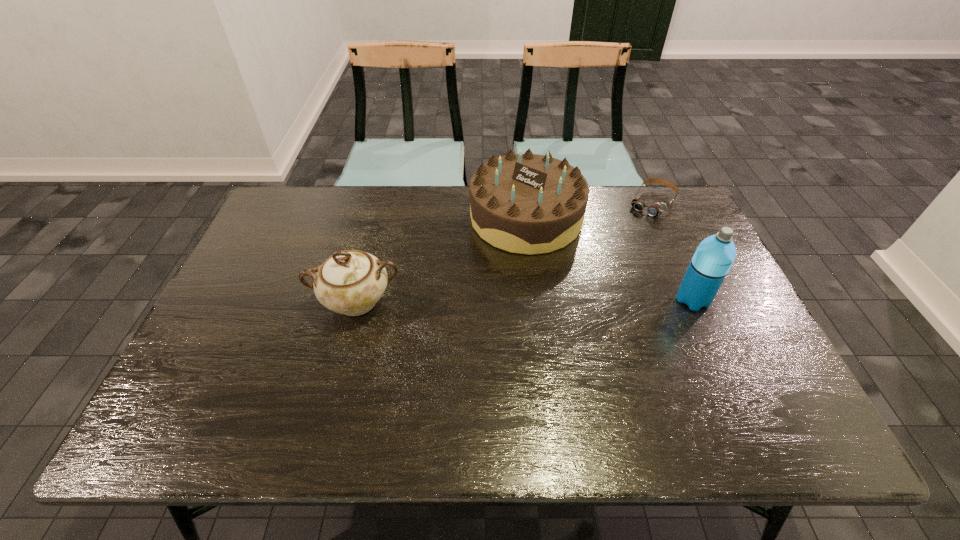
Image resolution: width=960 pixels, height=540 pixels. Find the location of `chinaware`. chinaware is located at coordinates (350, 282).

Where is `the tallest object`? the tallest object is located at coordinates (711, 262).

What are the coordinates of `the second object from left to right` in the screenshot? It's located at (527, 203).

At what (x,y) coordinates should I click in order to perform the action: click on the shortest object. Please return your answer as a coordinate pair (x, y). The image size is (960, 540). Looking at the image, I should click on (656, 209).

Image resolution: width=960 pixels, height=540 pixels. Identify the location of free spot located on the back of the leftmost object. (381, 205).

Locate an element on the screen. free space located 0.240m on the left of the tallest object is located at coordinates (586, 300).

Identify the location of blank area located 0.310m on the front-facing side of the birthday cake. (474, 334).

Find the location of `vacant area situated 0.130m on the front-facing side of the birthday cake`. vacant area situated 0.130m on the front-facing side of the birthday cake is located at coordinates (496, 284).

The image size is (960, 540). Identify the location of blank space located 0.250m on the front-facing side of the birthday cake. (482, 316).

Identify the location of free space located 0.260m on the front-facing side of the shortest object. The width and height of the screenshot is (960, 540). (608, 261).